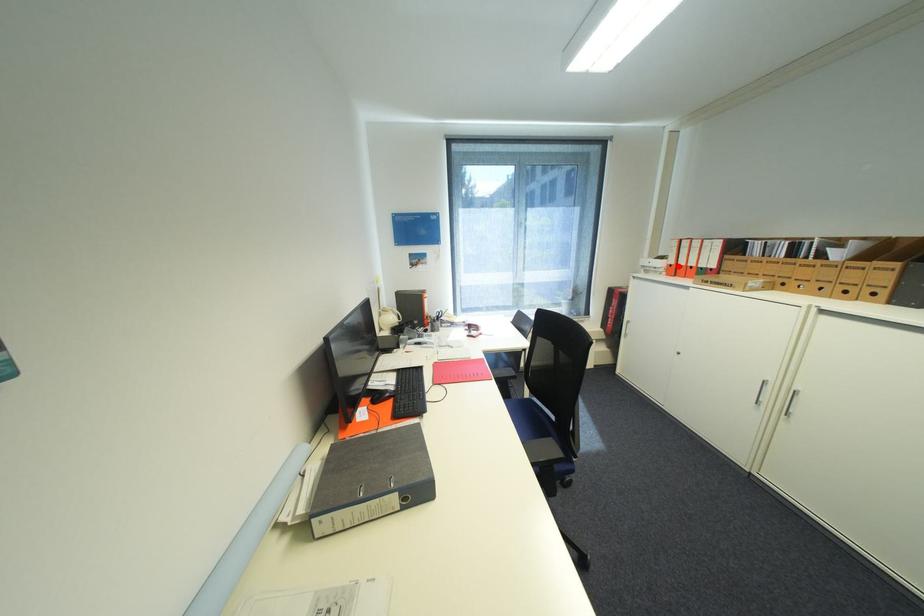
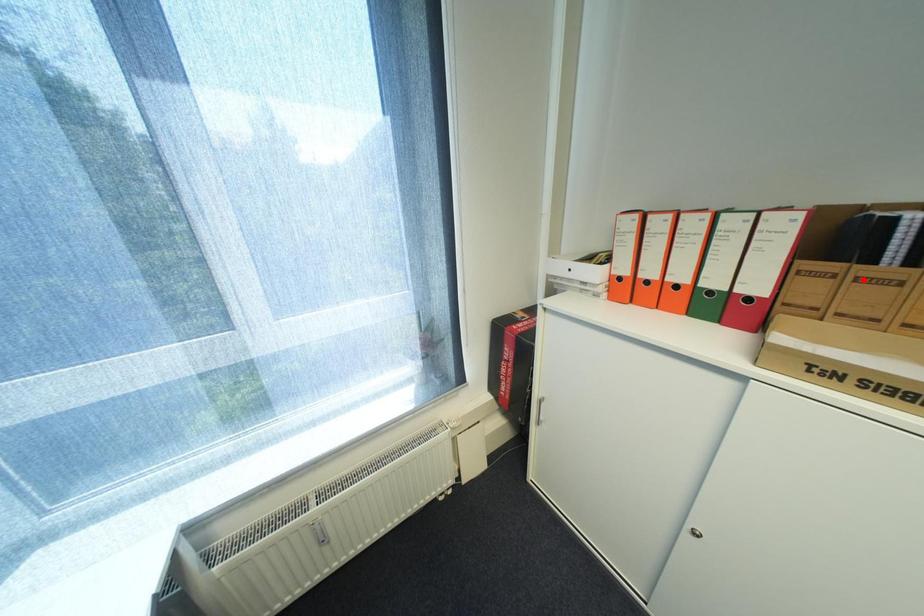
I am providing you with two images of the same scene from different viewpoints. A red point is marked on the first image and another point is marked on the second image. Is the marked point in image1 the same physical position as the marked point in image2?

No